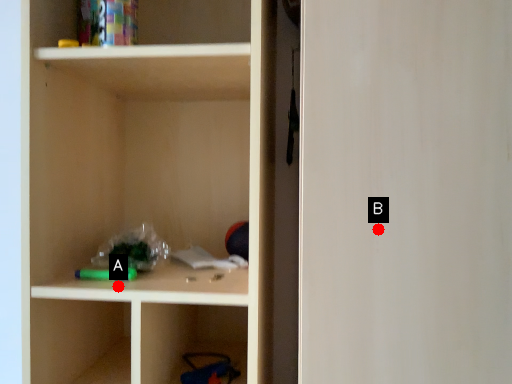
Question: Two points are circled on the image, labeled by A and B beside each circle. Which point is farther to the camera?

Choices:
 (A) A is further
 (B) B is further

Answer: (A)